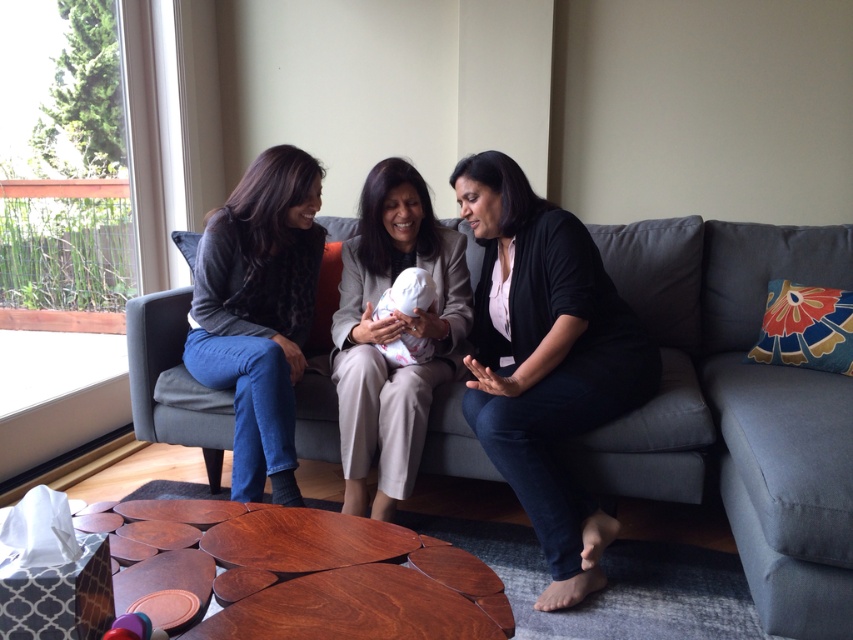
Between point (154, 324) and point (399, 353), which one is positioned behind?

The point (154, 324) is more distant.

Is point (711, 340) behind point (408, 340)?

Yes, point (711, 340) is behind point (408, 340).

Image resolution: width=853 pixels, height=640 pixels. Identify the location of gray fabric couch at center. 737,408.

Is gray fabric couch at center to the left of black matte blazer at center from the viewer's perspective?

No, gray fabric couch at center is not to the left of black matte blazer at center.

Is gray fabric couch at center behind black matte blazer at center?

No, it is not.

Locate an element on the screen. gray fabric couch at center is located at coordinates (737, 408).

Identify the location of gray fabric couch at center. Image resolution: width=853 pixels, height=640 pixels. click(x=737, y=408).

Does black matte blazer at center lie in front of light beige fabric baby at center?

Yes, it is.

Which is behind, point (560, 516) or point (376, 253)?

The point (376, 253) is behind.

Between point (534, 392) and point (416, 205), which one is positioned in front?

Point (534, 392)

Where is `black matte blazer at center`? This screenshot has width=853, height=640. black matte blazer at center is located at coordinates (546, 360).